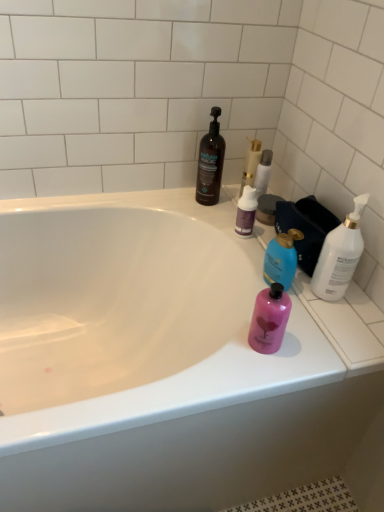
Find the location of a particular element. vacant space situated on the left part of silver metallic tube at upper center is located at coordinates (212, 201).